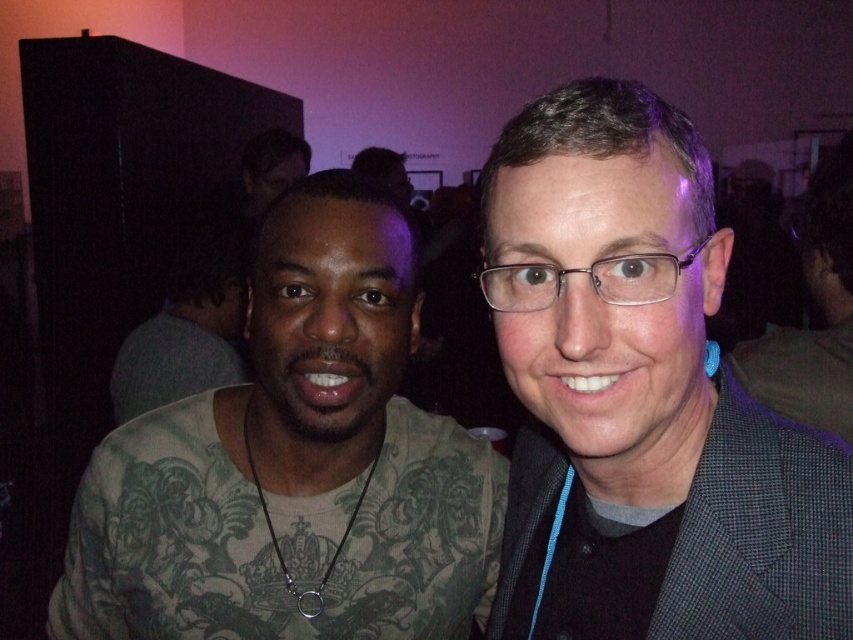
Question: Does gray checkered blazer at right appear on the left side of green tattooed shirt at left?

Choices:
 (A) no
 (B) yes

Answer: (A)

Question: Which of these objects is positioned closest to the gray checkered blazer at right?

Choices:
 (A) green tattooed shirt at left
 (B) green tattooed shirt at center

Answer: (A)

Question: Which point is closer to the camera?

Choices:
 (A) (113, 401)
 (B) (685, 252)
 (C) (387, 572)
 (D) (767, 342)

Answer: (B)

Question: Is green tattooed shirt at left wider than gray checkered suit at center?

Choices:
 (A) yes
 (B) no

Answer: (A)

Question: Estimate the real-world distances between objects in this image. Which object is farther from the green tattooed shirt at center?

Choices:
 (A) gray checkered suit at center
 (B) green tattooed shirt at left
 (C) gray checkered blazer at right

Answer: (C)

Question: Is green tattooed shirt at left smaller than gray checkered suit at center?

Choices:
 (A) no
 (B) yes

Answer: (B)